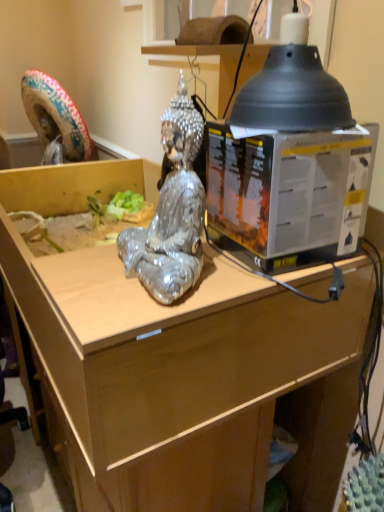
Question: From a real-world perspective, is shiny metallic statue at center positioned above or below metallic plastic box at center?

Choices:
 (A) below
 (B) above

Answer: (B)

Question: In the image, is shiny metallic statue at center on the left side or the right side of metallic plastic box at center?

Choices:
 (A) right
 (B) left

Answer: (B)

Question: Which object is positioned closest to the metallic plastic box at center?

Choices:
 (A) shiny metallic statue at center
 (B) wooden desk at center

Answer: (A)

Question: Estimate the real-world distances between objects in this image. Which object is farther from the metallic plastic box at center?

Choices:
 (A) wooden desk at center
 (B) shiny metallic statue at center

Answer: (A)